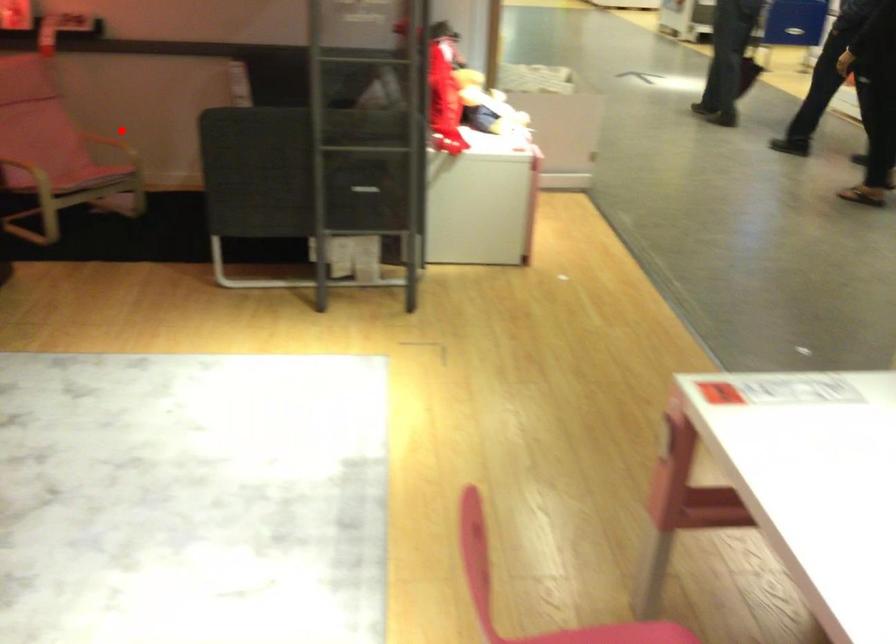
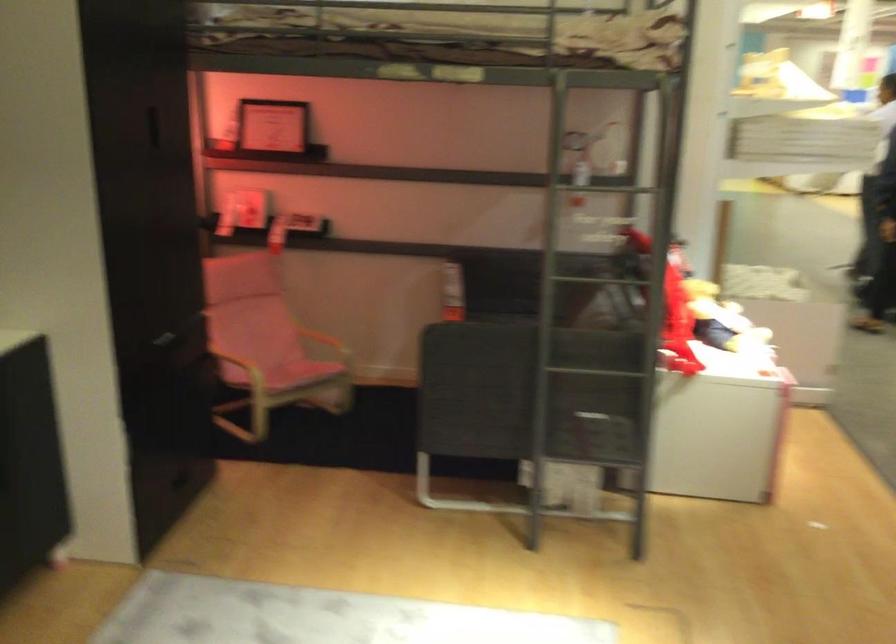
In the second image, find the point that corresponds to the highlighted location in the first image.

(332, 328)